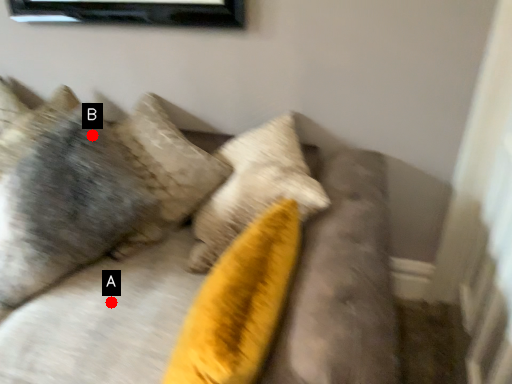
Question: Two points are circled on the image, labeled by A and B beside each circle. Which point is further to the camera?

Choices:
 (A) A is further
 (B) B is further

Answer: (B)